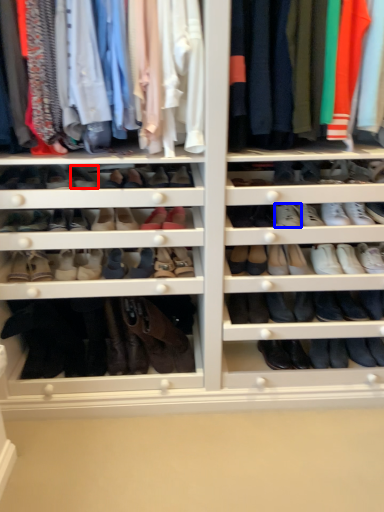
Question: Among these objects, which one is nearest to the camera, shoe (highlighted by a red box) or shoe (highlighted by a blue box)?

Choices:
 (A) shoe
 (B) shoe

Answer: (A)